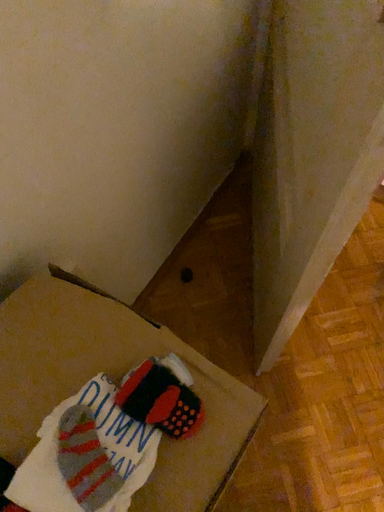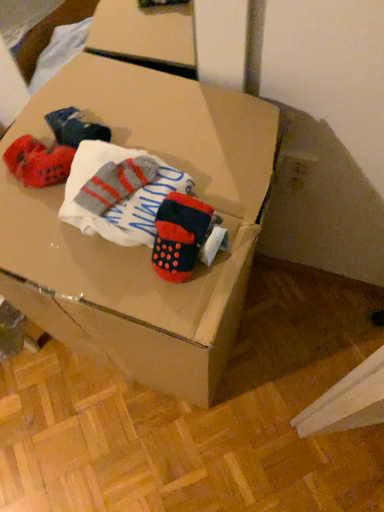
Question: Which way did the camera rotate in the video?

Choices:
 (A) rotated left
 (B) rotated right

Answer: (A)